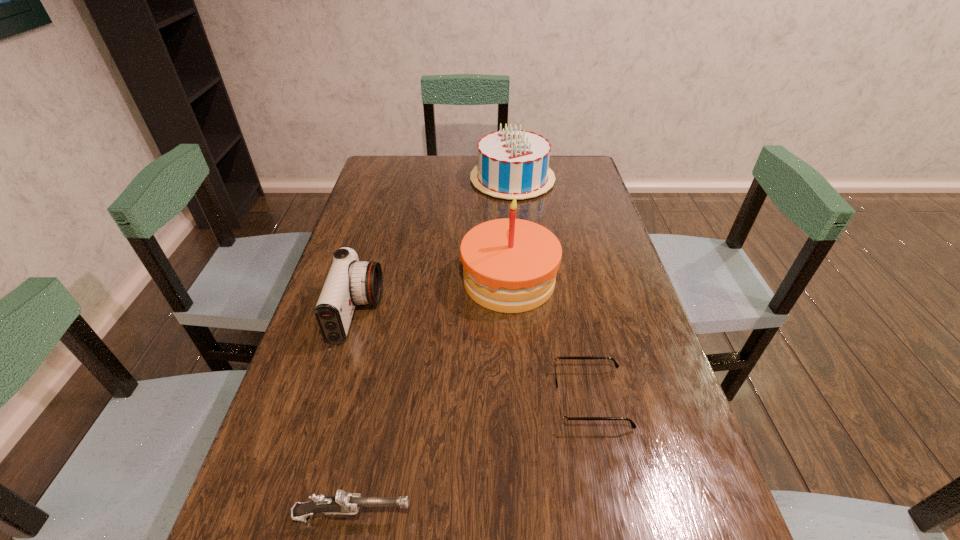
Locate an element on the screen. The height and width of the screenshot is (540, 960). spectacles present at the right edge is located at coordinates (564, 418).

The image size is (960, 540). What are the coordinates of `object present at the far right corner` in the screenshot? It's located at (513, 163).

Image resolution: width=960 pixels, height=540 pixels. I want to click on free space at the far edge of the desktop, so click(470, 161).

The height and width of the screenshot is (540, 960). I want to click on free space at the left edge, so click(290, 458).

Locate an element on the screen. This screenshot has height=540, width=960. vacant space at the right edge of the desktop is located at coordinates (597, 249).

Identify the location of free space at the far left corner of the desktop. (383, 160).

You are a GUI agent. You are given a task and a screenshot of the screen. Output one action in this format:
    pyautogui.click(x=<x>, y=<y>)
    Task: Click on the free space between the camcorder and the shortest object
    This screenshot has width=960, height=540.
    Given the screenshot: What is the action you would take?
    pyautogui.click(x=473, y=355)

At what (x,y) coordinates should I click in order to perform the action: click on vacant region between the third tallest object and the farther birthday cake. Please return your answer as a coordinate pair (x, y). The height and width of the screenshot is (540, 960). Looking at the image, I should click on (435, 246).

Where is `empty location between the nearest object and the tallest object`? The image size is (960, 540). empty location between the nearest object and the tallest object is located at coordinates (431, 398).

Locate an element on the screen. The width and height of the screenshot is (960, 540). vacant area between the nearer birthday cake and the nearest object is located at coordinates (431, 398).